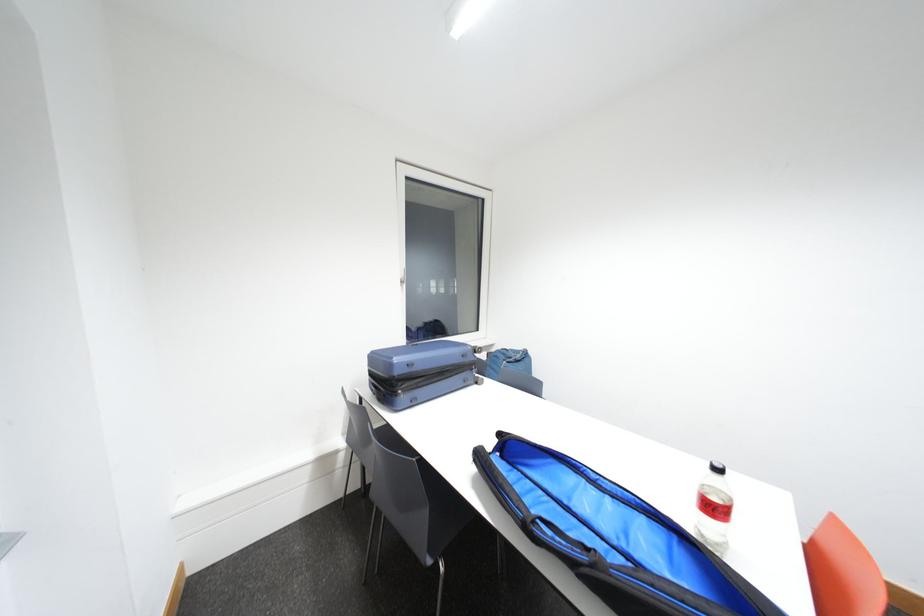
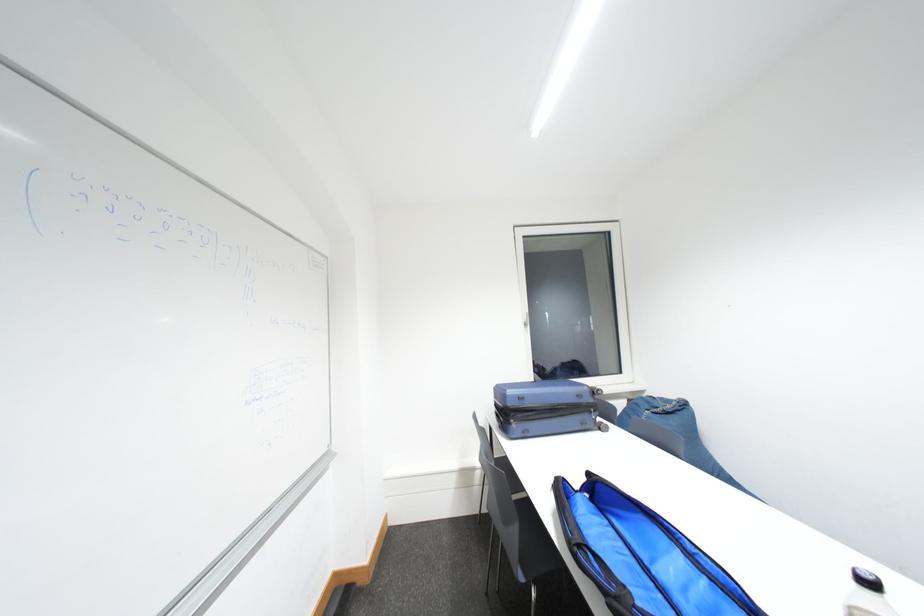
Question: The camera is either moving clockwise (left) or counter-clockwise (right) around the object. The first image is from the beginning of the video and the second image is from the end. Is the camera moving left or right when shooting the video?

Choices:
 (A) Left
 (B) Right

Answer: (B)